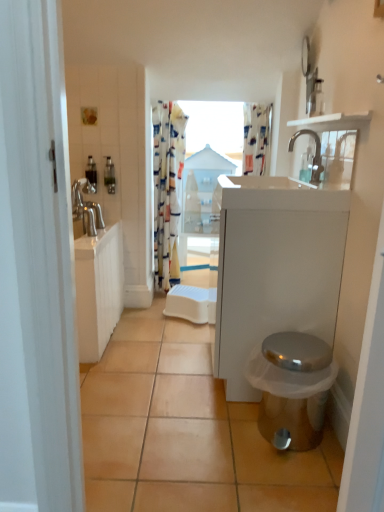
Identify the location of shiny metallic toilet at lower right. The image size is (384, 512). (292, 385).

Describe the element at coordinates (256, 138) in the screenshot. I see `patterned fabric shower curtain at upper center` at that location.

In order to face translucent plastic soap dispenser at left, should I rotate leftwards or rightwards?

You should look left and rotate roughly 13.466 degrees.

At what (x,y) coordinates should I click in order to perform the action: click on translucent plastic soap dispenser at left. Please return your answer as a coordinate pair (x, y). The width and height of the screenshot is (384, 512). Looking at the image, I should click on (91, 175).

Describe the element at coordinates (315, 154) in the screenshot. The height and width of the screenshot is (512, 384). I see `silver metallic faucet at upper center` at that location.

Measure the distance between matte white medicine cabinet at upper right and camera.

A distance of 4.72 feet exists between matte white medicine cabinet at upper right and camera.

At what (x,y) coordinates should I click in order to perform the action: click on shiny metallic toilet at lower right. Please return your answer as a coordinate pair (x, y). The width and height of the screenshot is (384, 512). Looking at the image, I should click on (292, 385).

Looking at this image, is white glossy sink at upper center not within white glossy cabinet at center?

Yes.

Considering the relative sizes of white glossy sink at upper center and white glossy cabinet at center in the image provided, is white glossy sink at upper center taller than white glossy cabinet at center?

Incorrect, the height of white glossy sink at upper center is not larger of that of white glossy cabinet at center.

Looking at this image, are white glossy cabinet at center and shiny metallic toilet at lower right located far from each other?

No.

Is white glossy cabinet at center wider than shiny metallic toilet at lower right?

Correct, the width of white glossy cabinet at center exceeds that of shiny metallic toilet at lower right.

The width and height of the screenshot is (384, 512). I want to click on toilet directly beneath the white glossy cabinet at center (from a real-world perspective), so click(x=292, y=385).

Does point (283, 224) come closer to viewer compared to point (182, 139)?

That is True.

From the image's perspective, would you say white glossy cabinet at center is shown under floral fabric curtain at center?

Yes, from the image's perspective, white glossy cabinet at center is beneath floral fabric curtain at center.

Which object is positioned more to the left, white glossy cabinet at center or floral fabric curtain at center?

From the viewer's perspective, floral fabric curtain at center appears more on the left side.

Is white glossy cabinet at center surrounding floral fabric curtain at center?

No, floral fabric curtain at center is not a part of white glossy cabinet at center.

Is point (302, 124) positioned in front of point (315, 234)?

No.

Considering the sizes of objects white wood shelf at upper right and white glossy cabinet at center in the image provided, who is shorter, white wood shelf at upper right or white glossy cabinet at center?

white wood shelf at upper right is shorter.

Do you think white wood shelf at upper right is within white glossy cabinet at center, or outside of it?

white wood shelf at upper right is not enclosed by white glossy cabinet at center.

Between white wood shelf at upper right and white glossy cabinet at center, which one has smaller size?

With smaller size is white wood shelf at upper right.

Measure the distance from floral fabric curtain at center to patterned fabric shower curtain at upper center.

floral fabric curtain at center and patterned fabric shower curtain at upper center are 20.90 inches apart from each other.

Is floral fabric curtain at center directly adjacent to patterned fabric shower curtain at upper center?

No, floral fabric curtain at center is not beside patterned fabric shower curtain at upper center.

Is floral fabric curtain at center in front of or behind patterned fabric shower curtain at upper center in the image?

In the image, floral fabric curtain at center appears in front of patterned fabric shower curtain at upper center.

Is patterned fabric shower curtain at upper center at the back of floral fabric curtain at center?

No, floral fabric curtain at center is not facing the opposite direction of patterned fabric shower curtain at upper center.

From the image's perspective, does orange matte tile at lower center appear higher than patterned fabric shower curtain at upper center?

No, from the image's perspective, orange matte tile at lower center is not on top of patterned fabric shower curtain at upper center.

Does orange matte tile at lower center have a greater width compared to patterned fabric shower curtain at upper center?

Yes, orange matte tile at lower center is wider than patterned fabric shower curtain at upper center.

Is orange matte tile at lower center far away from patterned fabric shower curtain at upper center?

Yes, orange matte tile at lower center and patterned fabric shower curtain at upper center are quite far apart.

Which of these two, orange matte tile at lower center or patterned fabric shower curtain at upper center, stands taller?

With more height is patterned fabric shower curtain at upper center.

From the image's perspective, is shiny metallic toilet at lower right below silver metallic faucet at upper center?

Yes.

The image size is (384, 512). Find the location of `tap behind the shiny metallic toilet at lower right`. tap behind the shiny metallic toilet at lower right is located at coordinates (315, 154).

Between point (292, 413) and point (313, 131), which one is positioned behind?

Point (313, 131)

From a real-world perspective, which object rests below the other?

shiny metallic toilet at lower right, from a real-world perspective.

What are the coordinates of `counter top in front of the white glossy cabinet at center` in the screenshot? It's located at (280, 194).

At what (x,y) coordinates should I click in order to perform the action: click on toilet that is on the right side of white glossy cabinet at center. Please return your answer as a coordinate pair (x, y). Looking at the image, I should click on (292, 385).

Considering their positions, is floral fabric curtain at center positioned closer to orange matte tile at lower center than translucent plastic soap dispenser at left?

floral fabric curtain at center is closer to orange matte tile at lower center.

Which object lies nearer to the anchor point white glossy cabinet at center, orange matte tile at lower center or silver metallic faucet at upper center?

silver metallic faucet at upper center is closer to white glossy cabinet at center.

Looking at the image, which one is located further to white wood shelf at upper right, orange matte tile at lower center or matte white medicine cabinet at upper right?

orange matte tile at lower center is further to white wood shelf at upper right.

Considering their positions, is orange matte tile at lower center positioned closer to shiny metallic toilet at lower right than white wood shelf at upper right?

Among the two, orange matte tile at lower center is located nearer to shiny metallic toilet at lower right.

Looking at the image, which one is located closer to shiny metallic toilet at lower right, translucent plastic soap dispenser at left or orange matte tile at lower center?

orange matte tile at lower center is positioned closer to the anchor shiny metallic toilet at lower right.

Estimate the real-world distances between objects in this image. Which object is closer to orange matte tile at lower center, silver metallic faucet at upper center or white wood shelf at upper right?

silver metallic faucet at upper center is closer to orange matte tile at lower center.

Looking at the image, which one is located closer to white glossy cabinet at center, shiny metallic toilet at lower right or orange matte tile at lower center?

The object closer to white glossy cabinet at center is shiny metallic toilet at lower right.

Considering their positions, is matte white medicine cabinet at upper right positioned further to silver metallic faucet at upper center than translucent plastic soap dispenser at left?

translucent plastic soap dispenser at left lies further to silver metallic faucet at upper center than the other object.

You are a GUI agent. You are given a task and a screenshot of the screen. Output one action in this format:
    pyautogui.click(x=<x>, y=<y>)
    Task: Click on the bathroom cabinet that lies between silver metallic faucet at upper center and shiny metallic toilet at lower right from top to bottom
    Image resolution: width=384 pixels, height=512 pixels.
    Given the screenshot: What is the action you would take?
    pyautogui.click(x=275, y=267)

You are a GUI agent. You are given a task and a screenshot of the screen. Output one action in this format:
    pyautogui.click(x=<x>, y=<y>)
    Task: Click on the medicine cabinet positioned between white wood shelf at upper right and floral fabric curtain at center from near to far
    This screenshot has width=384, height=512.
    Given the screenshot: What is the action you would take?
    pyautogui.click(x=338, y=156)

Where is `counter top between silver metallic faucet at upper center and orange matte tile at lower center in the vertical direction`? This screenshot has height=512, width=384. counter top between silver metallic faucet at upper center and orange matte tile at lower center in the vertical direction is located at coordinates (280, 194).

Where is `curtain between orange matte tile at lower center and patterned fabric shower curtain at upper center along the z-axis`? This screenshot has width=384, height=512. curtain between orange matte tile at lower center and patterned fabric shower curtain at upper center along the z-axis is located at coordinates click(x=167, y=183).